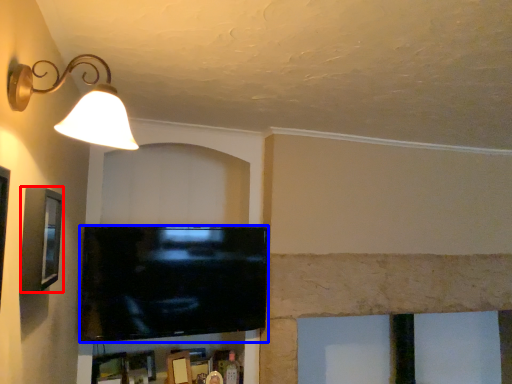
Question: Which of the following is the closest to the observer, picture frame (highlighted by a red box) or television (highlighted by a blue box)?

Choices:
 (A) picture frame
 (B) television

Answer: (A)